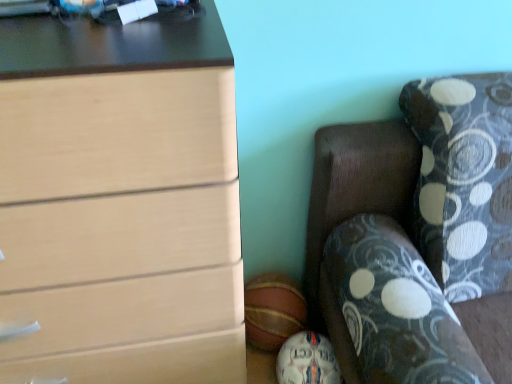
Question: Is matte wood chest of drawers at left placed right next to white leather soccer ball at lower center, the 2th sports equipment viewed from the top?

Choices:
 (A) no
 (B) yes

Answer: (A)

Question: From the image's perspective, would you say matte wood chest of drawers at left is shown under white leather soccer ball at lower center, the 2th sports equipment viewed from the top?

Choices:
 (A) no
 (B) yes

Answer: (A)

Question: Does matte wood chest of drawers at left have a larger size compared to white leather soccer ball at lower center, the 1th sports equipment when ordered from bottom to top?

Choices:
 (A) yes
 (B) no

Answer: (A)

Question: From a real-world perspective, is matte wood chest of drawers at left positioned under white leather soccer ball at lower center, the 1th sports equipment when ordered from bottom to top, based on gravity?

Choices:
 (A) yes
 (B) no

Answer: (B)

Question: Considering the relative sizes of matte wood chest of drawers at left and white leather soccer ball at lower center, the 2th sports equipment viewed from the top, in the image provided, is matte wood chest of drawers at left wider than white leather soccer ball at lower center, the 2th sports equipment viewed from the top,?

Choices:
 (A) no
 (B) yes

Answer: (B)

Question: Based on their sizes in the image, would you say white leather soccer ball at lower center, the 2th sports equipment viewed from the top, is bigger or smaller than matte wood chest of drawers at left?

Choices:
 (A) big
 (B) small

Answer: (B)

Question: In terms of width, does white leather soccer ball at lower center, the 2th sports equipment viewed from the top, look wider or thinner when compared to matte wood chest of drawers at left?

Choices:
 (A) thin
 (B) wide

Answer: (A)

Question: Considering the relative positions of white leather soccer ball at lower center, the 2th sports equipment viewed from the top, and matte wood chest of drawers at left in the image provided, is white leather soccer ball at lower center, the 2th sports equipment viewed from the top, to the left or to the right of matte wood chest of drawers at left?

Choices:
 (A) right
 (B) left

Answer: (A)

Question: Considering their positions, is white leather soccer ball at lower center, the 2th sports equipment viewed from the top, located in front of or behind matte wood chest of drawers at left?

Choices:
 (A) front
 (B) behind

Answer: (B)

Question: Considering their positions, is white leather soccer ball at lower center, the 2th sports equipment viewed from the top, located in front of or behind dark wood couch at lower right?

Choices:
 (A) behind
 (B) front

Answer: (A)

Question: From the image's perspective, is white leather soccer ball at lower center, the 1th sports equipment when ordered from bottom to top, above or below dark wood couch at lower right?

Choices:
 (A) above
 (B) below

Answer: (B)

Question: Looking at the image, does white leather soccer ball at lower center, the 1th sports equipment when ordered from bottom to top, seem bigger or smaller compared to dark wood couch at lower right?

Choices:
 (A) small
 (B) big

Answer: (A)

Question: From a real-world perspective, is white leather soccer ball at lower center, the 2th sports equipment viewed from the top, positioned above or below dark wood couch at lower right?

Choices:
 (A) below
 (B) above

Answer: (A)

Question: In terms of width, does white leather soccer ball at lower center, the 2th sports equipment viewed from the top, look wider or thinner when compared to rubber basketball at lower center, the 1th sports equipment positioned from the top?

Choices:
 (A) thin
 (B) wide

Answer: (B)

Question: In the image, is white leather soccer ball at lower center, the 2th sports equipment viewed from the top, positioned in front of or behind rubber basketball at lower center, the 1th sports equipment positioned from the top?

Choices:
 (A) front
 (B) behind

Answer: (A)